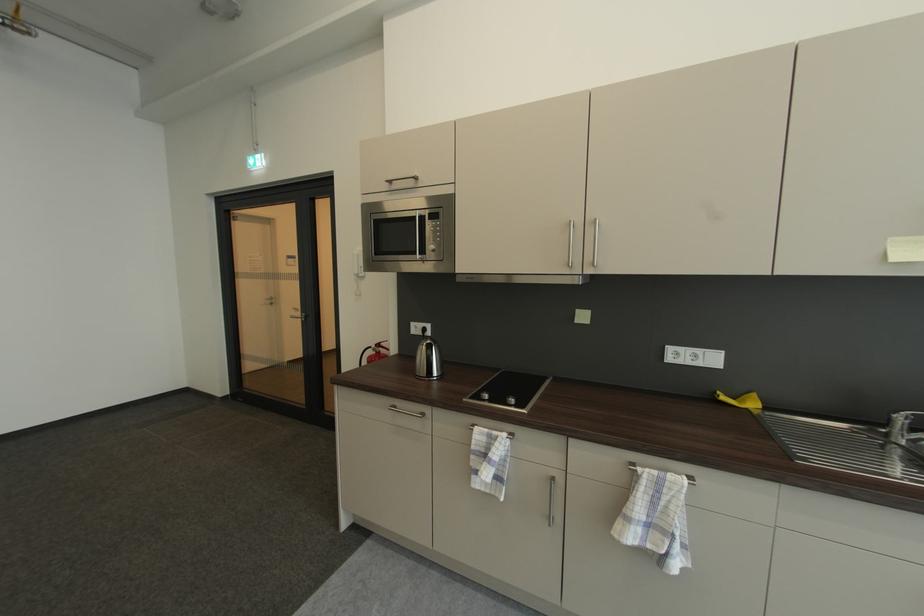
The width and height of the screenshot is (924, 616). Find the location of `silver kettle handle`. silver kettle handle is located at coordinates (428, 359).